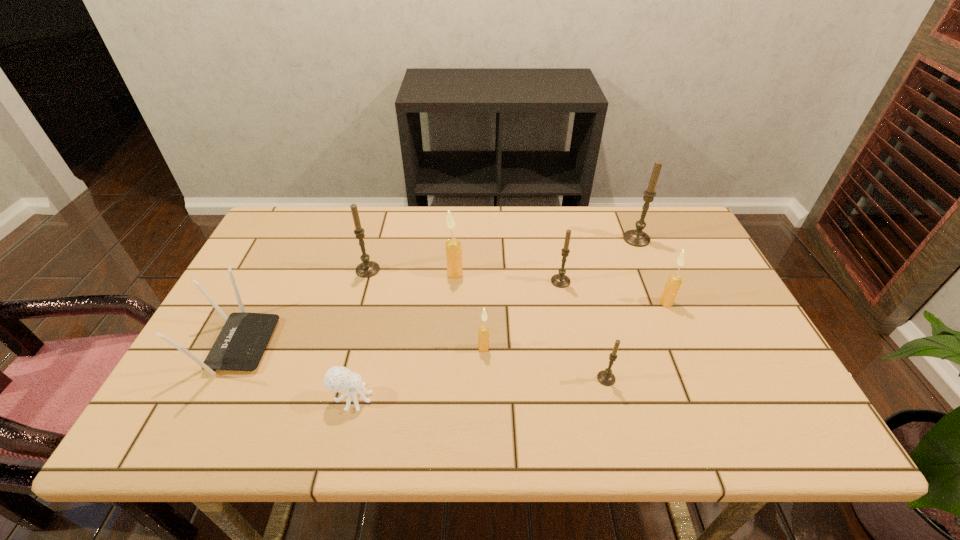
At what (x,y) coordinates should I click in order to perform the action: click on free space that is in between the leftmost gray candle and the nearest gray candle. Please return your answer as a coordinate pair (x, y). Looking at the image, I should click on (487, 324).

The width and height of the screenshot is (960, 540). I want to click on empty space between the second farthest cream candle and the third gray candle from left to right, so click(x=636, y=341).

What are the coordinates of `free spot between the leftmost candle and the second farthest cream candle` in the screenshot? It's located at (516, 286).

At what (x,y) coordinates should I click in order to perform the action: click on vacant space in between the shortest object and the fifth object from left to right. Please return your answer as a coordinate pair (x, y). Looking at the image, I should click on (418, 373).

Point out which object is positioned as the eighth nearest to the leftmost object. Please provide its 2D coordinates. Your answer should be formatted as a tuple, i.e. [(x, y)], where the tuple contains the x and y coordinates of a point satisfying the conditions above.

[(638, 238)]

The height and width of the screenshot is (540, 960). I want to click on object that stands as the fourth closest to the smallest cream candle, so click(560, 280).

At what (x,y) coordinates should I click in order to perform the action: click on the third closest candle to the fifth object from left to right. Please return your answer as a coordinate pair (x, y). The width and height of the screenshot is (960, 540). Looking at the image, I should click on (560, 280).

Image resolution: width=960 pixels, height=540 pixels. Find the location of `candle that stands as the third closest to the leftmost cream candle`. candle that stands as the third closest to the leftmost cream candle is located at coordinates (560, 280).

The height and width of the screenshot is (540, 960). Identify the location of gray candle that is the third nearest to the fifth nearest object. (605, 377).

You are a GUI agent. You are given a task and a screenshot of the screen. Output one action in this format:
    pyautogui.click(x=<x>, y=<y>)
    Task: Click on the fourth closest gray candle to the sixth farthest candle
    The height and width of the screenshot is (540, 960).
    Given the screenshot: What is the action you would take?
    pyautogui.click(x=638, y=238)